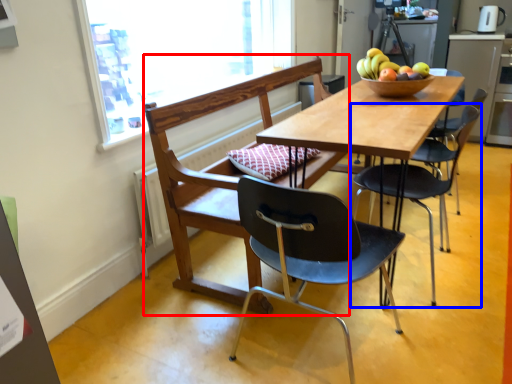
Question: Among these objects, which one is farthest to the camera, chair (highlighted by a red box) or chair (highlighted by a blue box)?

Choices:
 (A) chair
 (B) chair

Answer: (B)